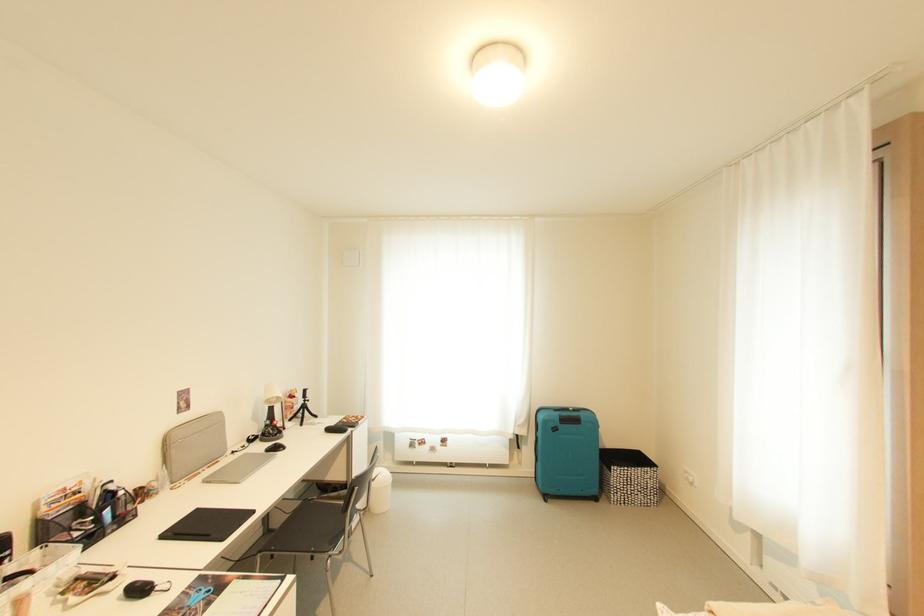
You are a GUI agent. You are given a task and a screenshot of the screen. Output one action in this format:
    pyautogui.click(x=<x>, y=<y>)
    Task: Click on the patterned storage box
    
    Given the screenshot: What is the action you would take?
    pyautogui.click(x=628, y=477)